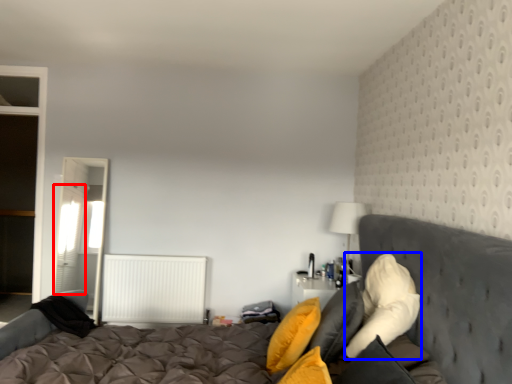
Question: Which of the following is the farthest to the observer, curtain (highlighted by a red box) or pillow (highlighted by a blue box)?

Choices:
 (A) curtain
 (B) pillow

Answer: (A)